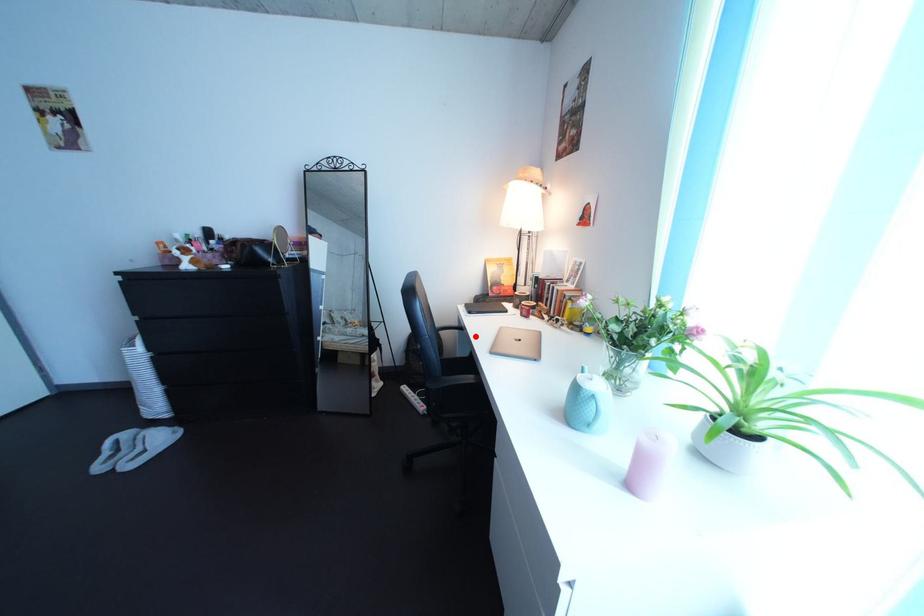
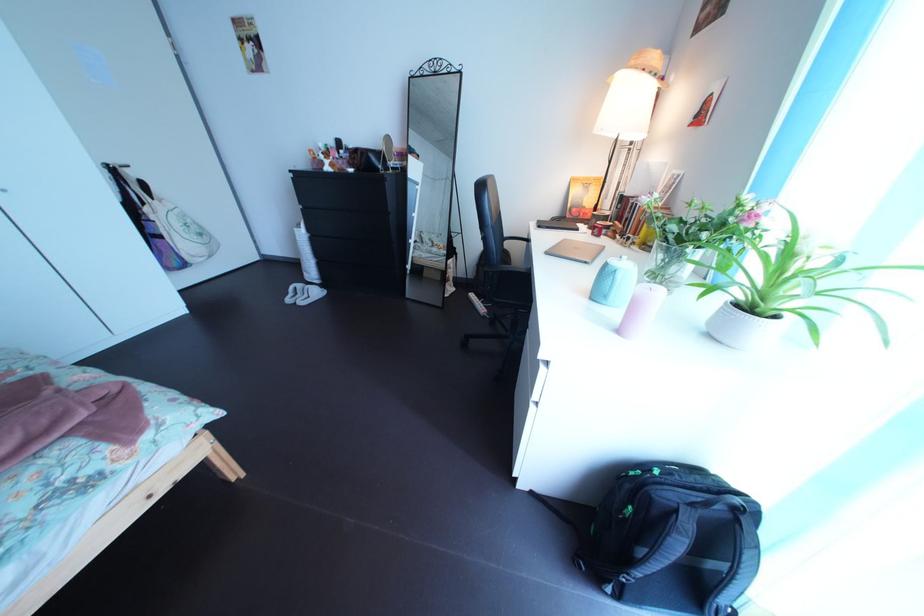
The point at the highlighted location is marked in the first image. Where is the corresponding point in the second image?

(541, 248)